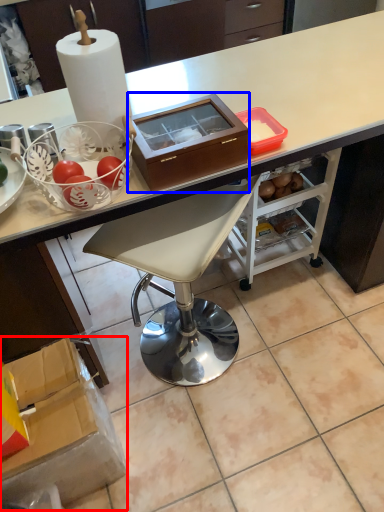
Question: Among these objects, which one is nearest to the camera, box (highlighted by a red box) or box (highlighted by a blue box)?

Choices:
 (A) box
 (B) box

Answer: (B)